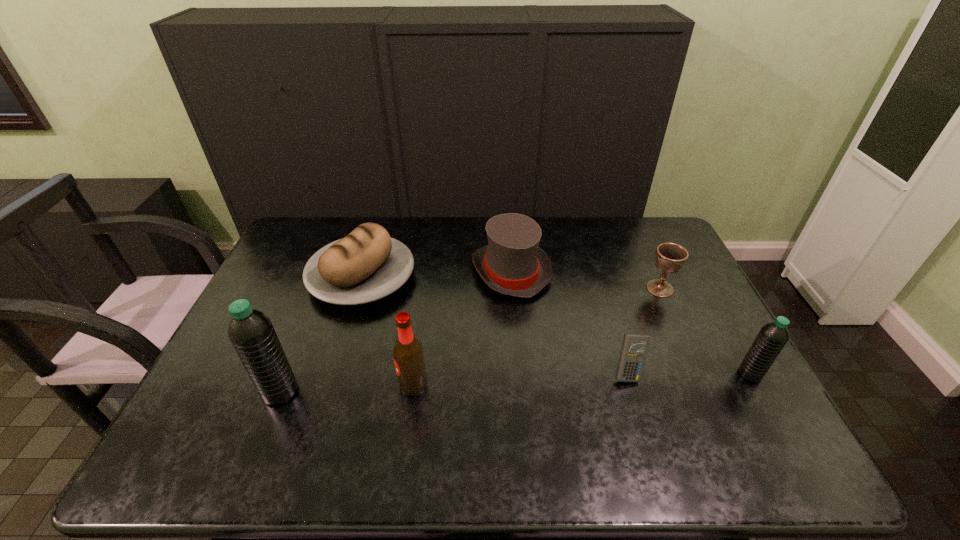
Please point a location where one more water_bottle can be added evenly. Please provide its 2D coordinates. Your answer should be formatted as a tuple, i.e. [(x, y)], where the tuple contains the x and y coordinates of a point satisfying the conditions above.

[(519, 382)]